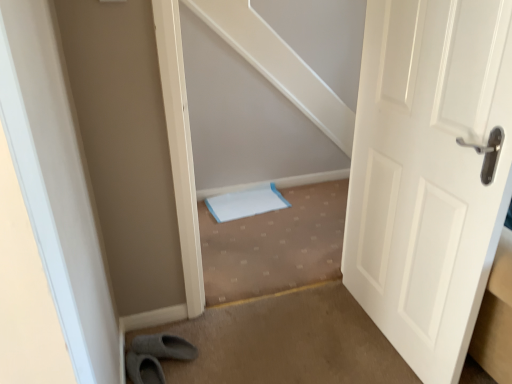
Describe the element at coordinates (429, 173) in the screenshot. I see `white matte door at right` at that location.

Locate an element on the screen. This screenshot has height=384, width=512. white matte door at right is located at coordinates (429, 173).

What do you see at coordinates (275, 245) in the screenshot? I see `carpeted stairwell at center` at bounding box center [275, 245].

Find the location of `carpeted stairwell at center`. carpeted stairwell at center is located at coordinates (275, 245).

In order to face carpeted stairwell at center, should I rotate leftwards or rightwards?

Rotate your view right by about 3.319°.

Identify the location of white matte door at right. (429, 173).

Looking at this image, is white matte door at right to the right of carpeted stairwell at center from the viewer's perspective?

Indeed, white matte door at right is positioned on the right side of carpeted stairwell at center.

Is white matte door at right positioned behind carpeted stairwell at center?

No, white matte door at right is closer to the viewer.

Which is closer, (404, 180) or (336, 253)?

Clearly, point (404, 180) is closer to the camera than point (336, 253).

From the image's perspective, which is above, white matte door at right or carpeted stairwell at center?

From the image's view, white matte door at right is above.

From a real-world perspective, who is located lower, white matte door at right or carpeted stairwell at center?

carpeted stairwell at center is physically lower.

In terms of width, does white matte door at right look wider or thinner when compared to carpeted stairwell at center?

In the image, white matte door at right appears to be more narrow than carpeted stairwell at center.

From their relative heights in the image, would you say white matte door at right is taller or shorter than carpeted stairwell at center?

Clearly, white matte door at right is taller compared to carpeted stairwell at center.

Does white matte door at right have a smaller size compared to carpeted stairwell at center?

Actually, white matte door at right might be larger than carpeted stairwell at center.

Would you say white matte door at right is inside or outside carpeted stairwell at center?

white matte door at right lies outside carpeted stairwell at center.

From the picture: Is there a large distance between white matte door at right and carpeted stairwell at center?

No, white matte door at right is not far away from carpeted stairwell at center.

Is white matte door at right positioned with its back to carpeted stairwell at center?

No, white matte door at right's orientation is not away from carpeted stairwell at center.

Find the location of a particular element. This screenshot has height=384, width=512. stairwell that is behind the white matte door at right is located at coordinates 275,245.

From the picture: Would you say carpeted stairwell at center is to the left or to the right of white matte door at right in the picture?

From the image, it's evident that carpeted stairwell at center is to the left of white matte door at right.

Relative to white matte door at right, is carpeted stairwell at center in front or behind?

carpeted stairwell at center is positioned farther from the viewer than white matte door at right.

Is point (244, 286) positioned after point (432, 224)?

That is True.

From the image's perspective, between carpeted stairwell at center and white matte door at right, which one is located above?

white matte door at right is shown above in the image.

From a real-world perspective, is carpeted stairwell at center over white matte door at right?

No.

Between carpeted stairwell at center and white matte door at right, which one has smaller width?

white matte door at right.

Based on the photo, considering the relative sizes of carpeted stairwell at center and white matte door at right in the image provided, is carpeted stairwell at center shorter than white matte door at right?

Correct, carpeted stairwell at center is not as tall as white matte door at right.

Considering the sizes of objects carpeted stairwell at center and white matte door at right in the image provided, who is smaller, carpeted stairwell at center or white matte door at right?

With smaller size is carpeted stairwell at center.

Which is correct: carpeted stairwell at center is inside white matte door at right, or outside of it?

carpeted stairwell at center is not enclosed by white matte door at right.

Are carpeted stairwell at center and white matte door at right far apart?

carpeted stairwell at center is actually quite close to white matte door at right.

Could you tell me if carpeted stairwell at center is turned towards white matte door at right?

No, carpeted stairwell at center is not turned towards white matte door at right.

Locate an element on the screen. The height and width of the screenshot is (384, 512). stairwell behind the white matte door at right is located at coordinates [x=275, y=245].

Where is `stairwell on the left of white matte door at right`? The width and height of the screenshot is (512, 384). stairwell on the left of white matte door at right is located at coordinates (275, 245).

Locate an element on the screen. stairwell behind the white matte door at right is located at coordinates (275, 245).